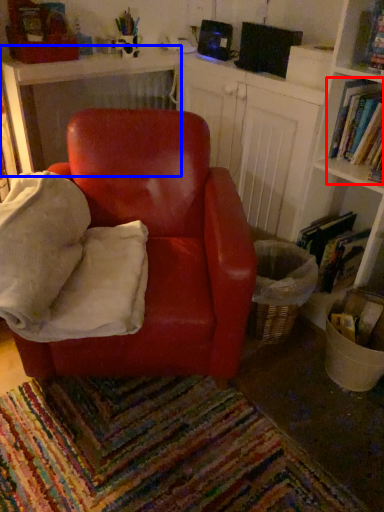
Question: Among these objects, which one is farthest to the camera, book (highlighted by a red box) or table (highlighted by a blue box)?

Choices:
 (A) book
 (B) table

Answer: (B)